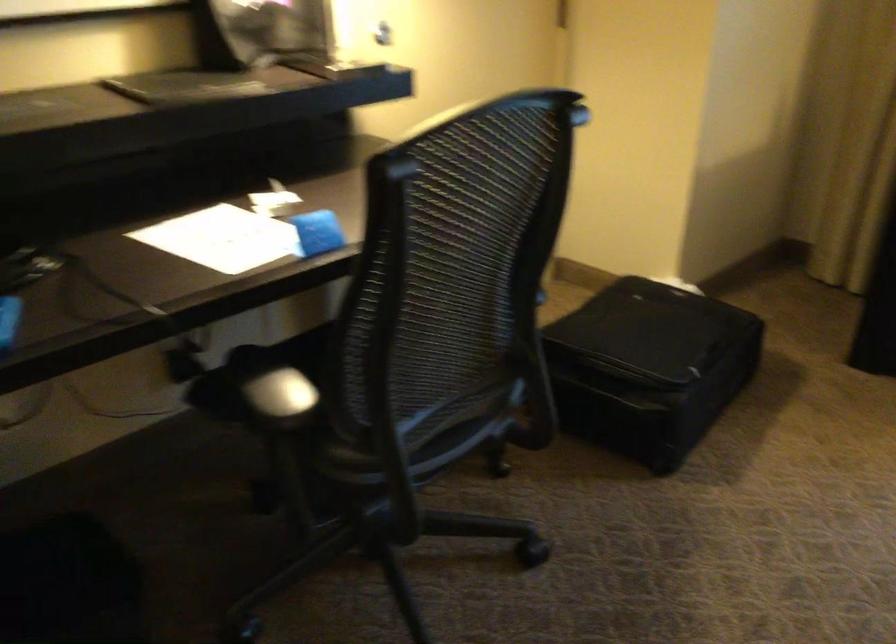
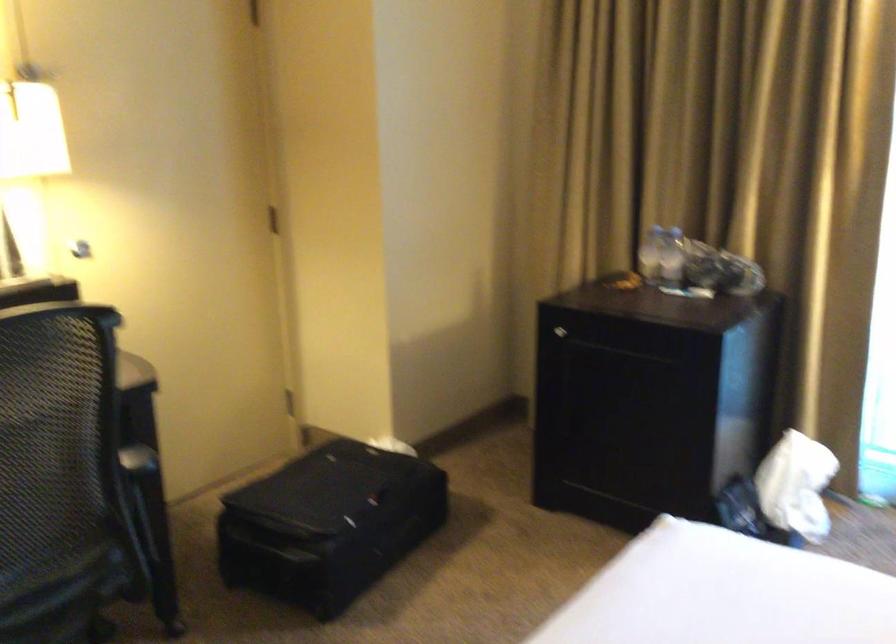
The point at [668,368] is marked in the first image. Where is the corresponding point in the second image?

(328, 524)